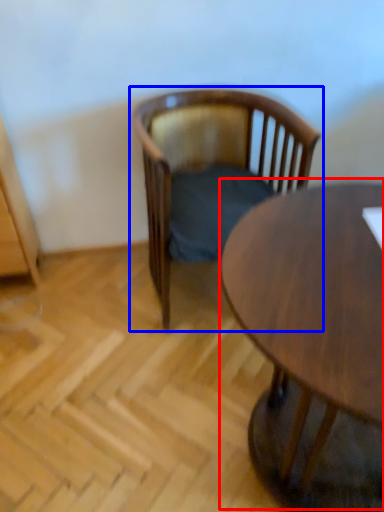
Question: Among these objects, which one is farthest to the camera, coffee table (highlighted by a red box) or chair (highlighted by a blue box)?

Choices:
 (A) coffee table
 (B) chair

Answer: (B)